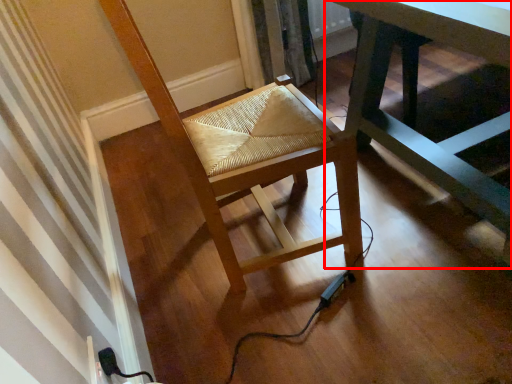
Question: Observing the image, what is the correct spatial positioning of table (annotated by the red box) in reference to chair?

Choices:
 (A) left
 (B) right

Answer: (B)